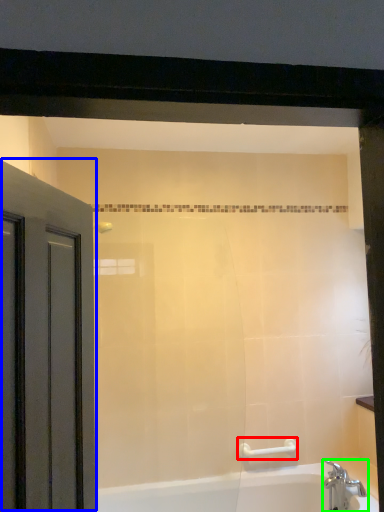
Question: Estimate the real-world distances between objects in this image. Which object is farther from towel bar (highlighted by a red box), door (highlighted by a blue box) or tap (highlighted by a green box)?

Choices:
 (A) door
 (B) tap

Answer: (A)